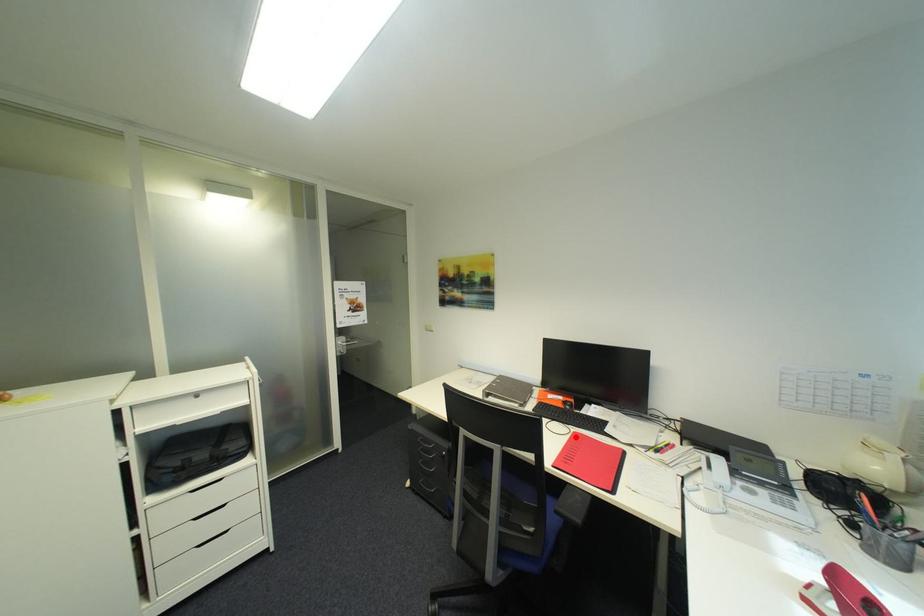
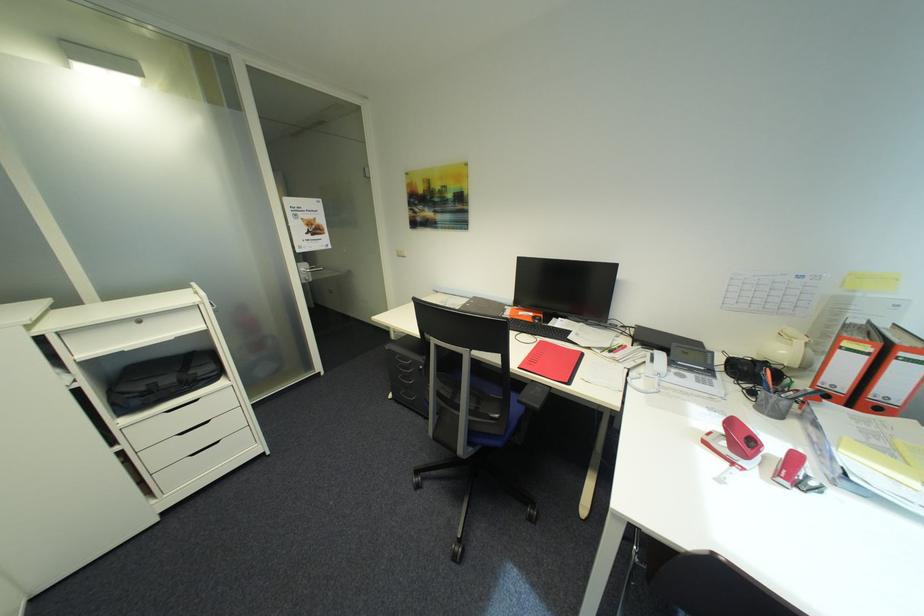
The point at the highlighted location is marked in the first image. Where is the corresponding point in the second image?

(542, 345)